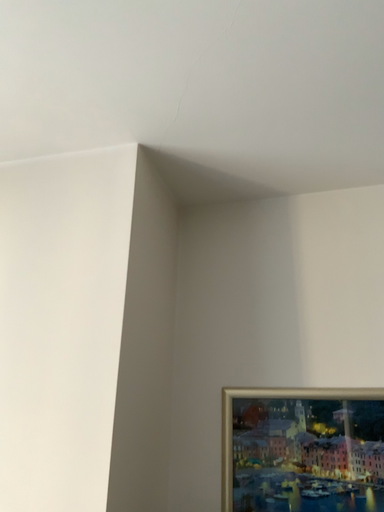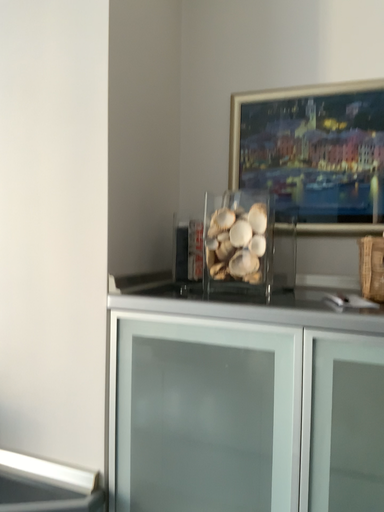
Question: How did the camera likely rotate when shooting the video?

Choices:
 (A) rotated upward
 (B) rotated downward

Answer: (B)